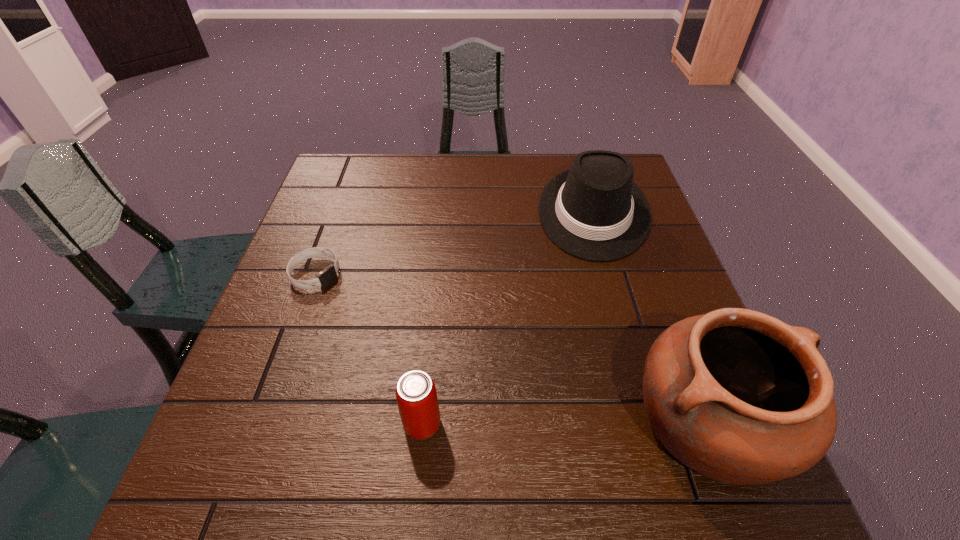
The width and height of the screenshot is (960, 540). In order to click on object that is positioned at the near right corner in this screenshot , I will do `click(738, 396)`.

The image size is (960, 540). In order to click on vacant area at the far edge of the desktop in this screenshot , I will do `click(490, 173)`.

The image size is (960, 540). In the image, there is a desktop. Identify the location of free space at the near edge. (347, 418).

The width and height of the screenshot is (960, 540). In order to click on blank area at the left edge in this screenshot , I will do `click(319, 265)`.

Find the location of a particular element. The height and width of the screenshot is (540, 960). free space at the right edge is located at coordinates (644, 282).

Identify the location of free space between the fedora and the second object from left to right. (508, 318).

Where is `vacant area that lies between the fedora and the leftmost object`? vacant area that lies between the fedora and the leftmost object is located at coordinates (454, 243).

Find the location of `unoccupied position between the fedora and the pottery`. unoccupied position between the fedora and the pottery is located at coordinates (651, 318).

Image resolution: width=960 pixels, height=540 pixels. Identify the location of free spot between the beer can and the pottery. (565, 423).

Identify the location of empty space that is in between the fedora and the pottery. The width and height of the screenshot is (960, 540). (651, 318).